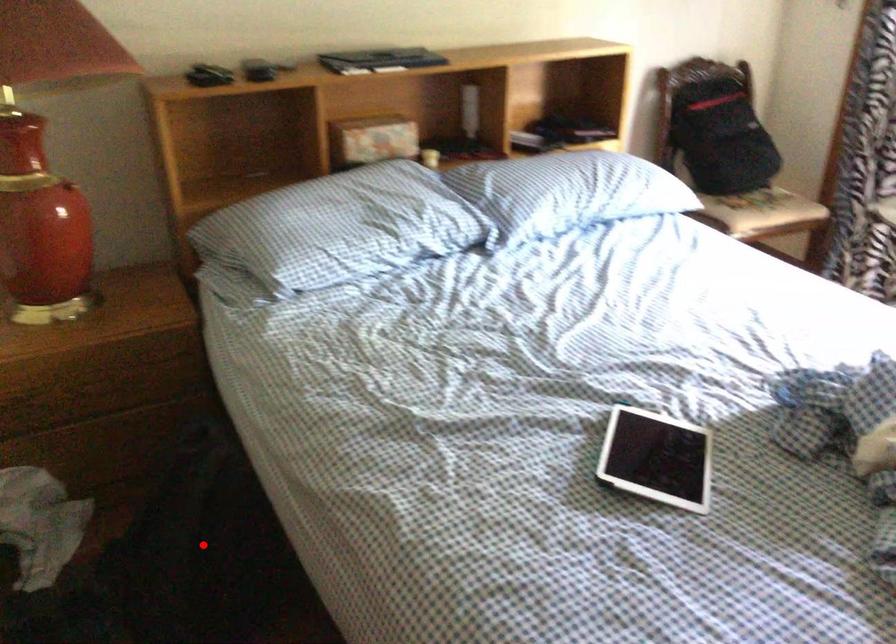
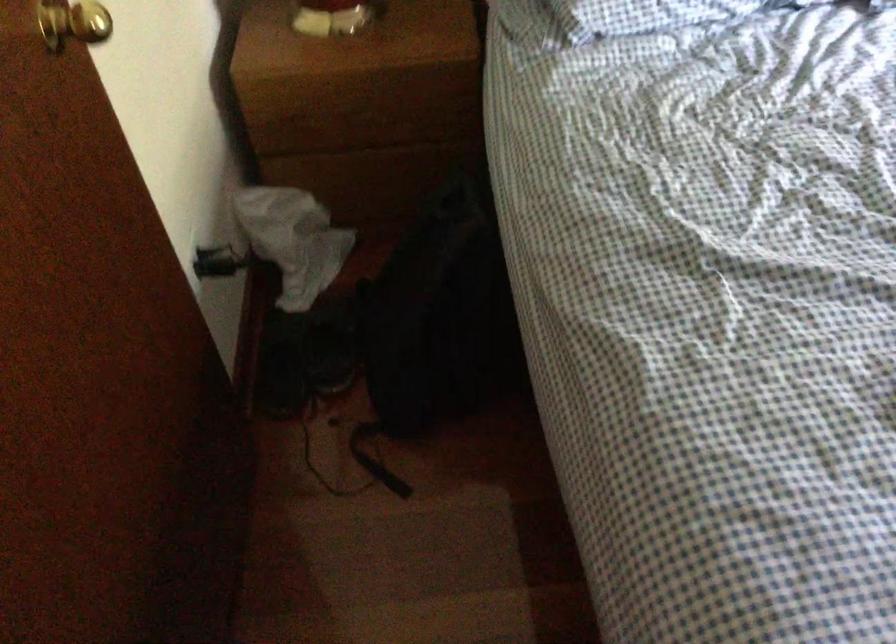
Locate, in the second image, the point that corresponds to the highlighted location in the first image.

(441, 317)